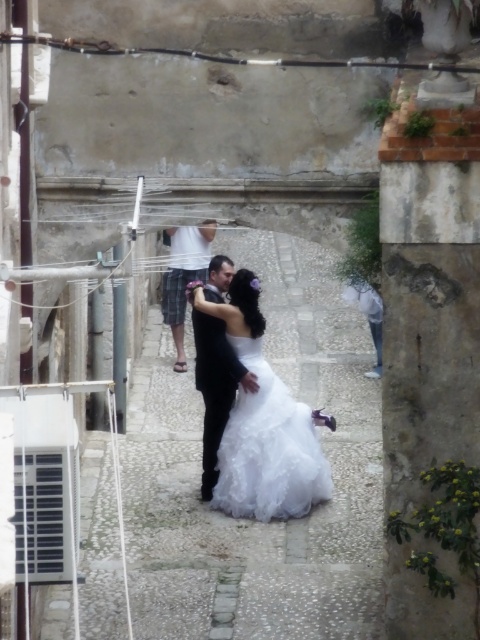
Question: Which point is farther from the camera taking this photo?

Choices:
 (A) (172, 227)
 (B) (312, 500)
 (C) (255, 502)
 (D) (196, 349)

Answer: (D)

Question: Among these objects, which one is nearest to the camera?

Choices:
 (A) white satin dress at center
 (B) black satin suit at center
 (C) white lace dress at center

Answer: (C)

Question: Which object is positioned closest to the white lace dress at center?

Choices:
 (A) white satin dress at center
 (B) black satin suit at center
 (C) white cotton shirt at center

Answer: (A)

Question: Can you confirm if white lace dress at center is positioned to the right of white cotton shirt at center?

Choices:
 (A) no
 (B) yes

Answer: (B)

Question: Can you confirm if white satin dress at center is thinner than white lace dress at center?

Choices:
 (A) no
 (B) yes

Answer: (B)

Question: Is white lace dress at center further to camera compared to white cotton shirt at center?

Choices:
 (A) yes
 (B) no

Answer: (B)